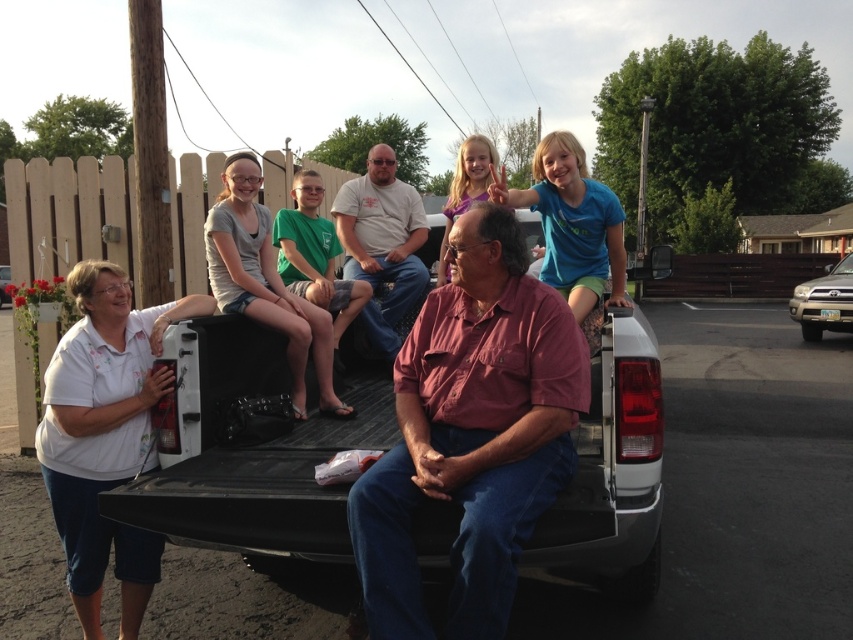
Is matte pink shirt at center to the right of white matte shirt at lower left from the viewer's perspective?

Correct, you'll find matte pink shirt at center to the right of white matte shirt at lower left.

Measure the distance between point (387, 477) and camera.

They are 8.27 feet apart.

Image resolution: width=853 pixels, height=640 pixels. What are the coordinates of `matte pink shirt at center` in the screenshot? It's located at coord(473,433).